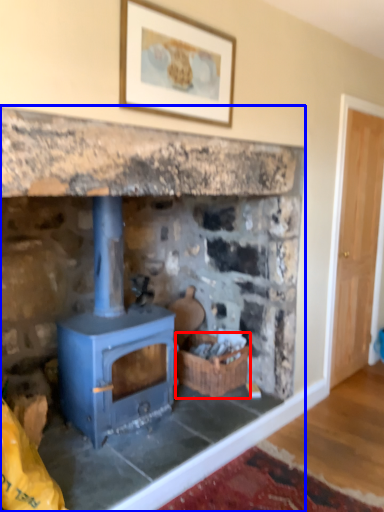
Question: Which object appears farthest to the camera in this image, basket (highlighted by a red box) or fireplace (highlighted by a blue box)?

Choices:
 (A) basket
 (B) fireplace

Answer: (A)